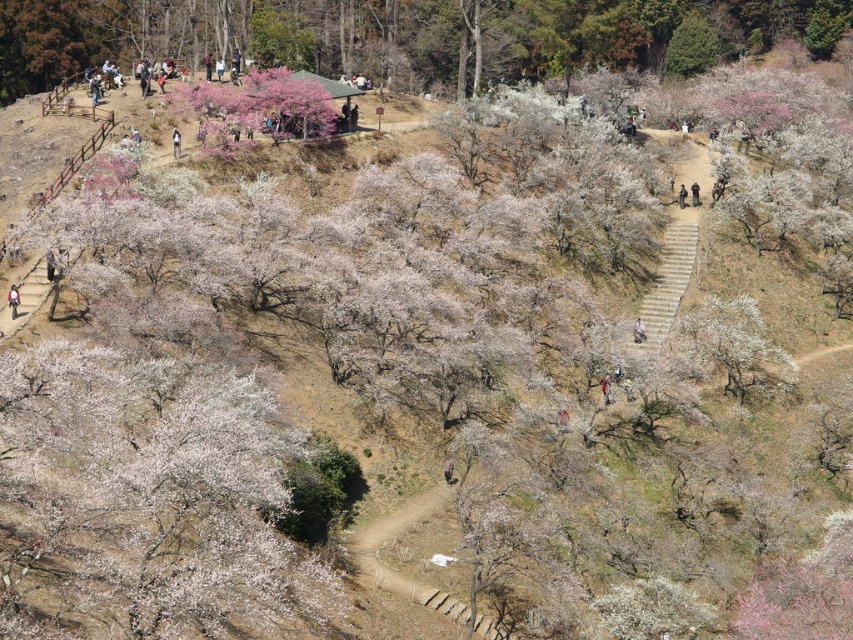
Which is above, light brown leather jacket at lower left or light brown wooden bench at center?

light brown leather jacket at lower left is above.

Between point (13, 307) and point (634, 330), which one is positioned in front?

Positioned in front is point (13, 307).

Find the location of a particular element. Image resolution: width=853 pixels, height=640 pixels. light brown leather jacket at lower left is located at coordinates (13, 300).

Does pink blossoms at center have a smaller size compared to light brown leather jacket at upper center?

No, pink blossoms at center is not smaller than light brown leather jacket at upper center.

Which is behind, point (12, 90) or point (172, 132)?

The point (12, 90) is more distant.

This screenshot has width=853, height=640. Describe the element at coordinates (399, 35) in the screenshot. I see `pink blossoms at center` at that location.

Identify the location of pink blossoms at center. The width and height of the screenshot is (853, 640). (399, 35).

Which is below, light brown wooden bench at center or dark brown leather jacket at center?

light brown wooden bench at center is below.

Which is more to the left, light brown wooden bench at center or dark brown leather jacket at center?

From the viewer's perspective, light brown wooden bench at center appears more on the left side.

What do you see at coordinates (637, 332) in the screenshot? I see `light brown wooden bench at center` at bounding box center [637, 332].

Where is `light brown wooden bench at center`? Image resolution: width=853 pixels, height=640 pixels. light brown wooden bench at center is located at coordinates (637, 332).